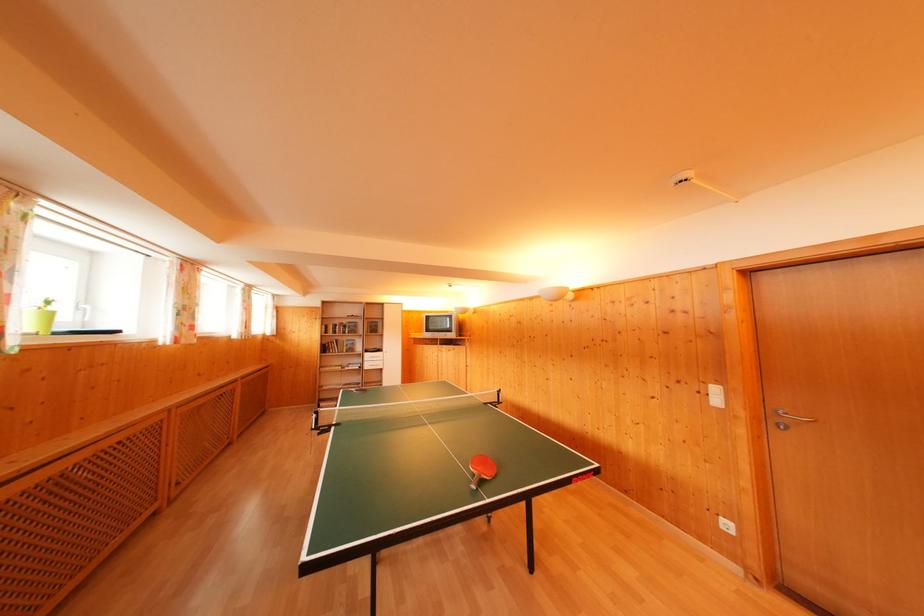
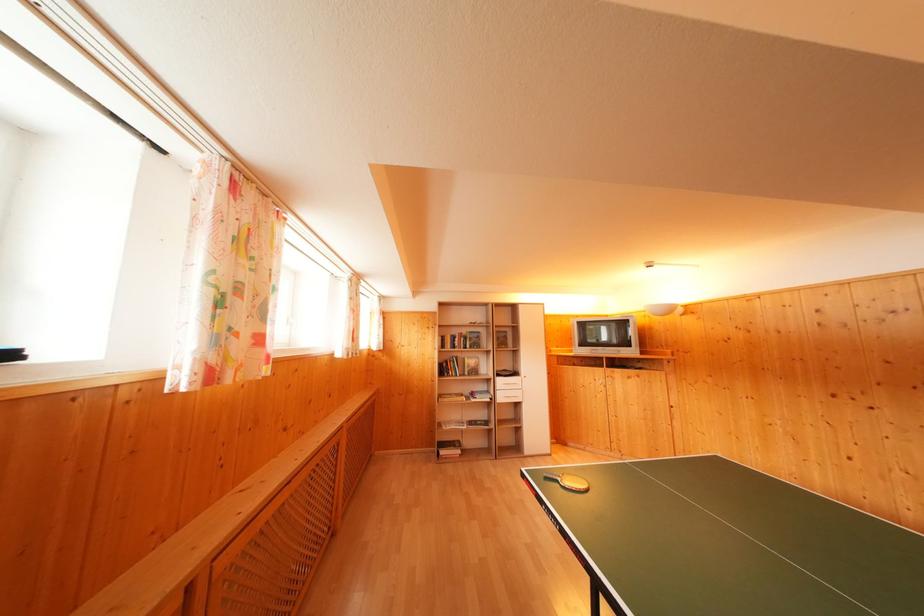
In a continuous first-person perspective shot, in which direction is the camera moving?

The movement direction of the cameraman is left, forward.